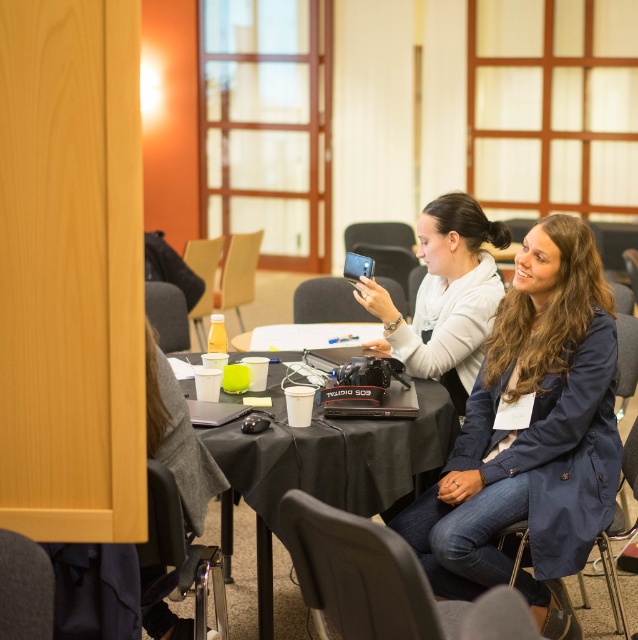
Question: Among these points, which one is farthest from the camera?

Choices:
 (A) (249, 278)
 (B) (602, 324)
 (C) (189, 252)
 (D) (397, 292)

Answer: (A)

Question: Considering the relative positions of gray fabric chair at lower left and black leather chair at lower left in the image provided, where is gray fabric chair at lower left located with respect to black leather chair at lower left?

Choices:
 (A) below
 (B) above

Answer: (B)

Question: In this image, where is matte gray chair at lower center located relative to navy blue fabric chair at lower right?

Choices:
 (A) right
 (B) left

Answer: (B)

Question: Which of these objects is positioned closest to the navy blue fabric chair at lower right?

Choices:
 (A) black fabric table at center
 (B) yellow plastic cup at center

Answer: (A)

Question: Can you confirm if matte black chair at left is positioned below yellow plastic cup at center?

Choices:
 (A) no
 (B) yes

Answer: (B)

Question: Which object appears closest to the camera in this image?

Choices:
 (A) black leather chair at lower left
 (B) matte black camera at center
 (C) matte black chair at center
 (D) navy blue fabric chair at lower right

Answer: (A)